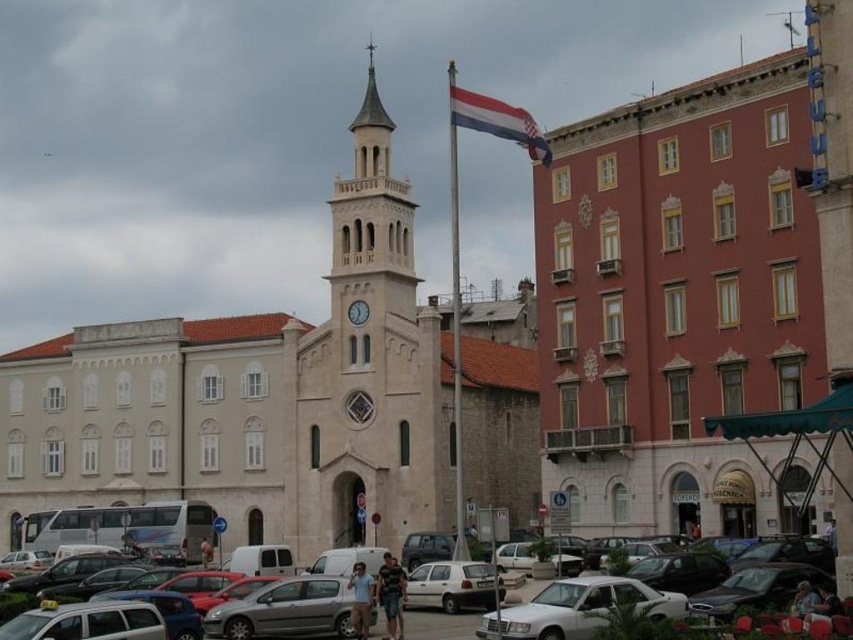
Is point (431, 368) farther from camera compared to point (549, 616)?

Yes.

Between white stone clock tower at center and white glossy sedan at center, which one is positioned lower?

white glossy sedan at center

Is point (351, 508) positioned in front of point (630, 592)?

No.

At what (x,y) coordinates should I click in order to perform the action: click on white stone clock tower at center. Please return your answer as a coordinate pair (x, y). The height and width of the screenshot is (640, 853). Looking at the image, I should click on (367, 369).

Which of these two, metallic gray cars at lower center or red and white striped flag at center, stands shorter?

With less height is metallic gray cars at lower center.

Which is behind, point (427, 620) or point (523, 138)?

Point (523, 138)

Find the location of a particular element. Image resolution: width=853 pixels, height=640 pixels. metallic gray cars at lower center is located at coordinates (438, 625).

Between white stone clock tower at center and silver metallic hatchback at center, which one appears on the right side from the viewer's perspective?

silver metallic hatchback at center

Who is shorter, white stone clock tower at center or silver metallic hatchback at center?

silver metallic hatchback at center is shorter.

Between point (357, 483) and point (289, 634), which one is positioned in front?

Point (289, 634) is more forward.

At what (x,y) coordinates should I click in order to perform the action: click on white stone clock tower at center. Please return your answer as a coordinate pair (x, y). The width and height of the screenshot is (853, 640). Looking at the image, I should click on click(367, 369).